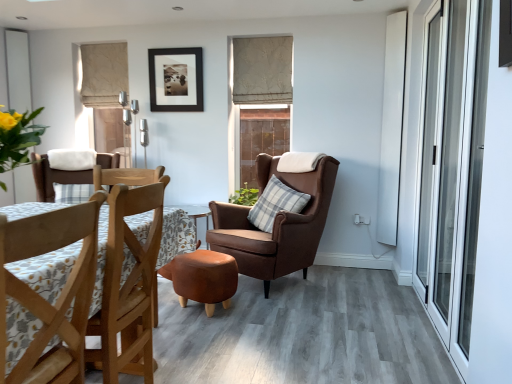
Question: Is wooden chair at center, marked as the 3th chair in a front-to-back arrangement, positioned before plaid fabric pillow at center?

Choices:
 (A) no
 (B) yes

Answer: (A)

Question: Can you confirm if wooden chair at center, marked as the 3th chair in a front-to-back arrangement, is shorter than plaid fabric pillow at center?

Choices:
 (A) yes
 (B) no

Answer: (A)

Question: From the image's perspective, is wooden chair at center, marked as the 3th chair in a front-to-back arrangement, over plaid fabric pillow at center?

Choices:
 (A) no
 (B) yes

Answer: (B)

Question: Considering the relative sizes of wooden chair at center, which is counted as the 3th chair, starting from the right, and plaid fabric pillow at center in the image provided, is wooden chair at center, which is counted as the 3th chair, starting from the right, bigger than plaid fabric pillow at center?

Choices:
 (A) no
 (B) yes

Answer: (A)

Question: Is wooden chair at center, marked as the first chair in a back-to-front arrangement, looking in the opposite direction of plaid fabric pillow at center?

Choices:
 (A) no
 (B) yes

Answer: (A)

Question: From a real-world perspective, does wooden chair at center, which is the first chair in left-to-right order, sit lower than plaid fabric pillow at center?

Choices:
 (A) yes
 (B) no

Answer: (B)

Question: Can you confirm if leather ottoman at center is taller than plaid fabric pillow at center?

Choices:
 (A) no
 (B) yes

Answer: (A)

Question: Are leather ottoman at center and plaid fabric pillow at center beside each other?

Choices:
 (A) yes
 (B) no

Answer: (B)

Question: Is leather ottoman at center not inside plaid fabric pillow at center?

Choices:
 (A) no
 (B) yes

Answer: (B)

Question: Does leather ottoman at center have a greater width compared to plaid fabric pillow at center?

Choices:
 (A) yes
 (B) no

Answer: (A)

Question: Considering the relative positions of leather ottoman at center and plaid fabric pillow at center in the image provided, is leather ottoman at center behind plaid fabric pillow at center?

Choices:
 (A) no
 (B) yes

Answer: (A)

Question: Does leather ottoman at center have a lesser width compared to plaid fabric pillow at center?

Choices:
 (A) yes
 (B) no

Answer: (B)

Question: Can you see transparent glass screen door at right touching white matte window at upper left, the second window when ordered from right to left?

Choices:
 (A) yes
 (B) no

Answer: (B)